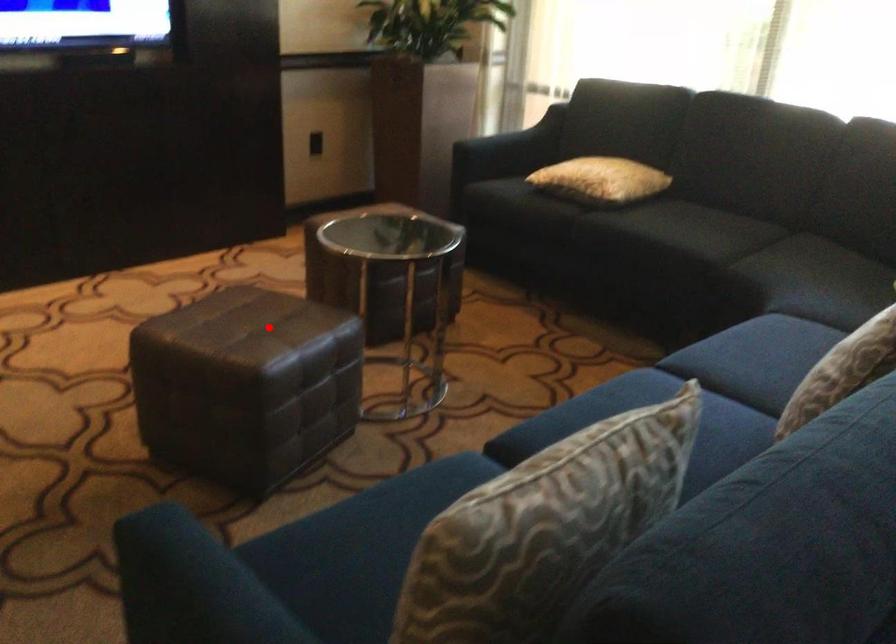
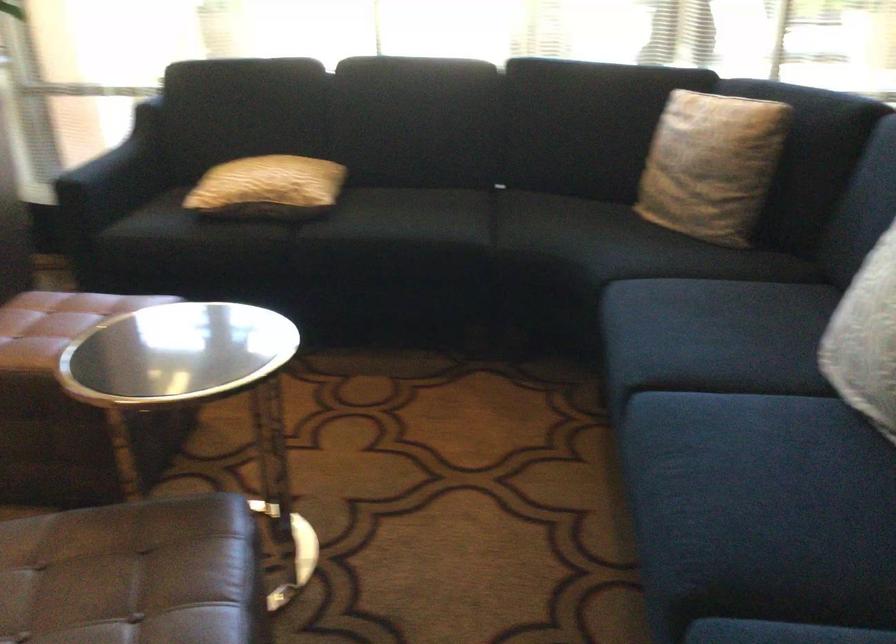
In the second image, find the point that corresponds to the highlighted location in the first image.

(134, 574)